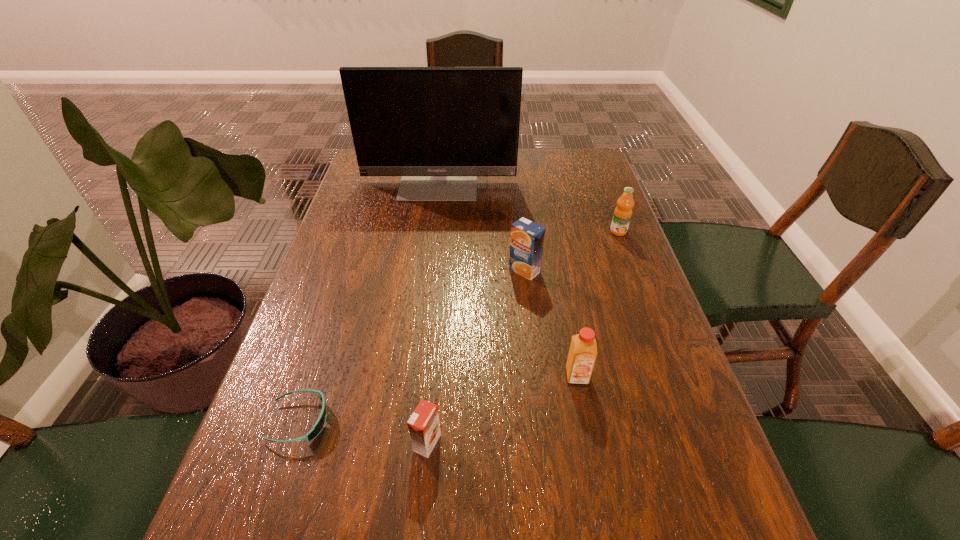
In order to click on the tallest object in this screenshot , I will do `click(439, 128)`.

The height and width of the screenshot is (540, 960). I want to click on the farthest object, so click(x=439, y=128).

Find the location of a particular element. Image resolution: width=960 pixels, height=540 pixels. the second orange juice from left to right is located at coordinates (527, 238).

You are a GUI agent. You are given a task and a screenshot of the screen. Output one action in this format:
    pyautogui.click(x=<x>, y=<y>)
    Task: Click on the second farthest orange juice
    The width and height of the screenshot is (960, 540).
    Given the screenshot: What is the action you would take?
    pyautogui.click(x=527, y=238)

Where is `the rightmost object`? The image size is (960, 540). the rightmost object is located at coordinates (623, 211).

I want to click on the rightmost orange juice, so click(x=623, y=211).

Where is `the third nearest object`? This screenshot has width=960, height=540. the third nearest object is located at coordinates (582, 355).

You are a GUI agent. You are given a task and a screenshot of the screen. Output one action in this format:
    pyautogui.click(x=<x>, y=<y>)
    Task: Click on the second orange juice from right to left
    The height and width of the screenshot is (540, 960).
    Given the screenshot: What is the action you would take?
    pyautogui.click(x=582, y=355)

Image resolution: width=960 pixels, height=540 pixels. Find the location of `the shortest orange juice`. the shortest orange juice is located at coordinates (424, 427).

Identify the location of the leftmost orange juice. This screenshot has height=540, width=960. (424, 427).